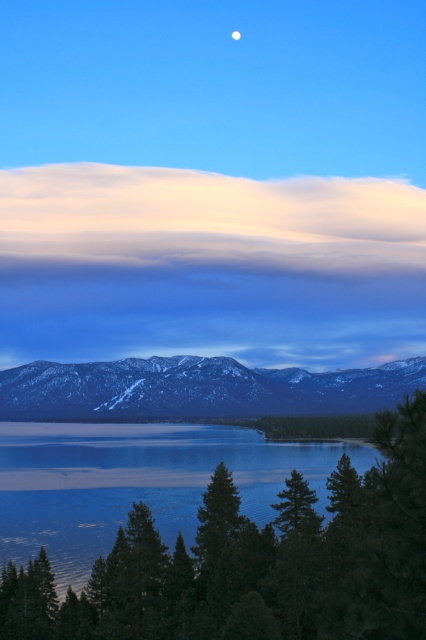
Does blue glassy water at lower center appear on the right side of white matte moon at upper center?

In fact, blue glassy water at lower center is to the left of white matte moon at upper center.

Is blue glassy water at lower center thinner than white matte moon at upper center?

No, blue glassy water at lower center is not thinner than white matte moon at upper center.

Which is behind, point (268, 512) or point (236, 38)?

The point (236, 38) is behind.

Find the location of `blue glassy water at lower center`. blue glassy water at lower center is located at coordinates (138, 483).

Is point (49, 426) closer to camera compared to point (293, 531)?

No, it is behind (293, 531).

Can you confirm if blue glassy water at lower center is positioned to the right of green matte tree at center?

No, blue glassy water at lower center is not to the right of green matte tree at center.

Find the location of `blue glassy water at lower center`. blue glassy water at lower center is located at coordinates [x=138, y=483].

The image size is (426, 640). I want to click on blue glassy water at lower center, so click(x=138, y=483).

Is point (45, 532) less distant than point (137, 412)?

Yes.

Can you confirm if blue glassy water at lower center is taller than snow-covered mountain range at center?

In fact, blue glassy water at lower center may be shorter than snow-covered mountain range at center.

You are a GUI agent. You are given a task and a screenshot of the screen. Output one action in this format:
    pyautogui.click(x=<x>, y=<y>)
    Task: Click on the blue glassy water at lower center
    The height and width of the screenshot is (640, 426).
    Given the screenshot: What is the action you would take?
    pyautogui.click(x=138, y=483)